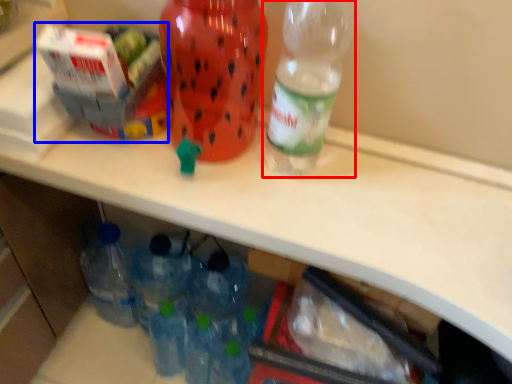
Question: Among these objects, which one is farthest to the camera, bottle (highlighted by a red box) or box (highlighted by a blue box)?

Choices:
 (A) bottle
 (B) box

Answer: (B)